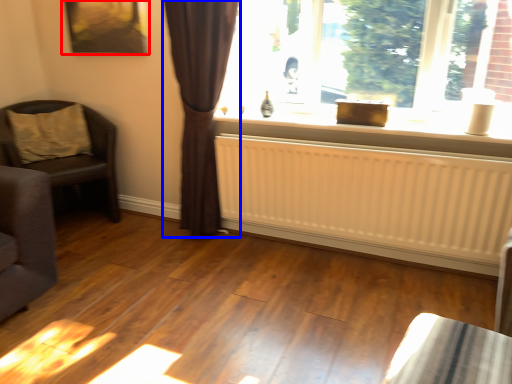
Question: Which object is further to the camera taking this photo, picture frame (highlighted by a red box) or curtain (highlighted by a blue box)?

Choices:
 (A) picture frame
 (B) curtain

Answer: (A)